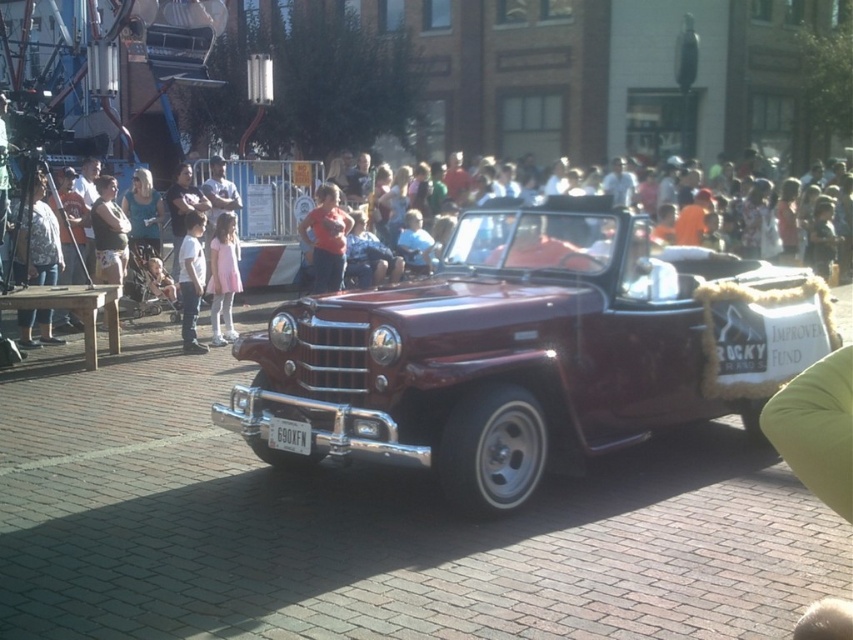
You are a photographer standing at the side of the street during the parade. You want to take a photo of both the shiny maroon convertible at center and the pink satin dress at center. Since you can only focus on one subject at a time, which object should you focus on first to ensure it appears in focus, considering their heights?

The shiny maroon convertible at center is taller than the pink satin dress at center. Therefore, you should focus on the shiny maroon convertible at center first to ensure it is in focus, as taller objects are often better captured when prioritized in the frame.

You are a photographer at the event and want to capture both the matte red shirt at center and the white cotton shirt at left in a single photo. Which shirt should you focus on to ensure both are in frame without zooming in or out?

You should focus on the matte red shirt at center because it is larger than the white cotton shirt at left, so keeping it centered will allow the smaller white cotton shirt at left to fit within the frame without needing to adjust the zoom.